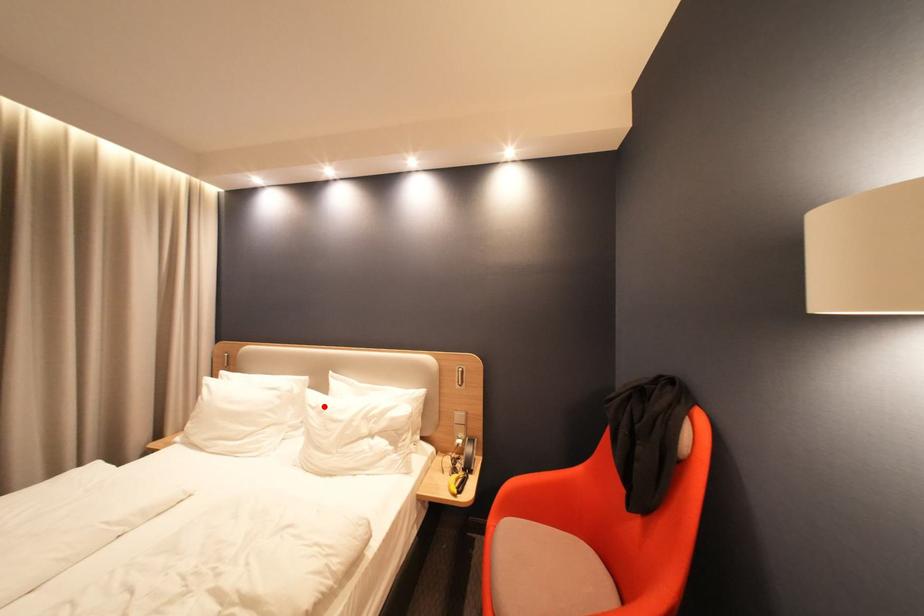
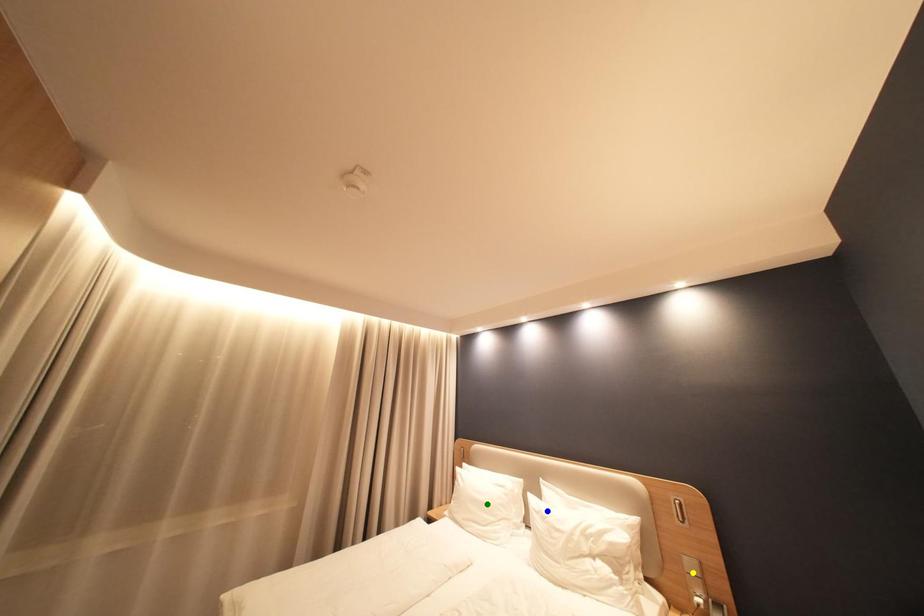
Question: I am providing you with two images of the same scene from different viewpoints. A red point is marked on the first image. You are given multiple points on the second image. Can you choose the point in image 2 that corresponds to the point in image 1?

Choices:
 (A) green point
 (B) yellow point
 (C) blue point

Answer: (C)